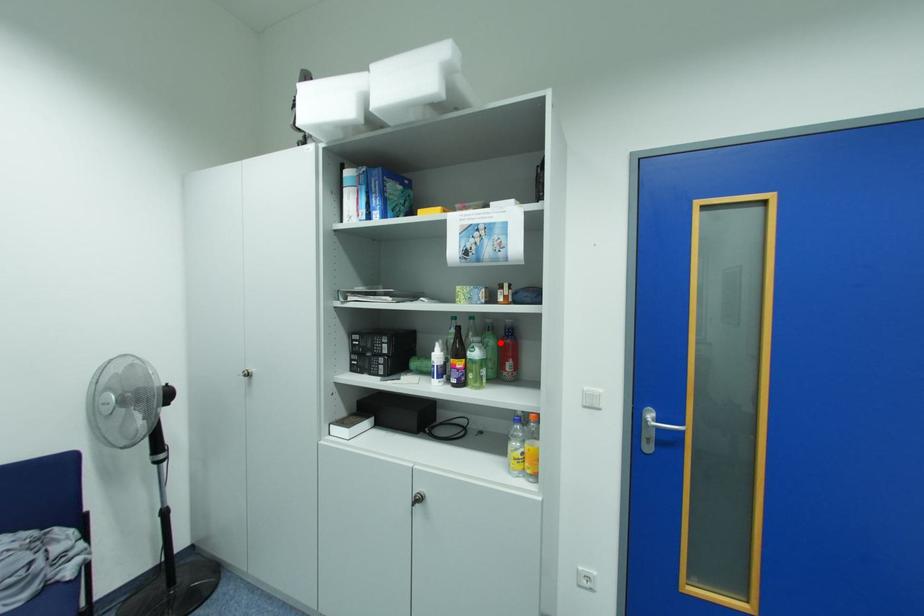
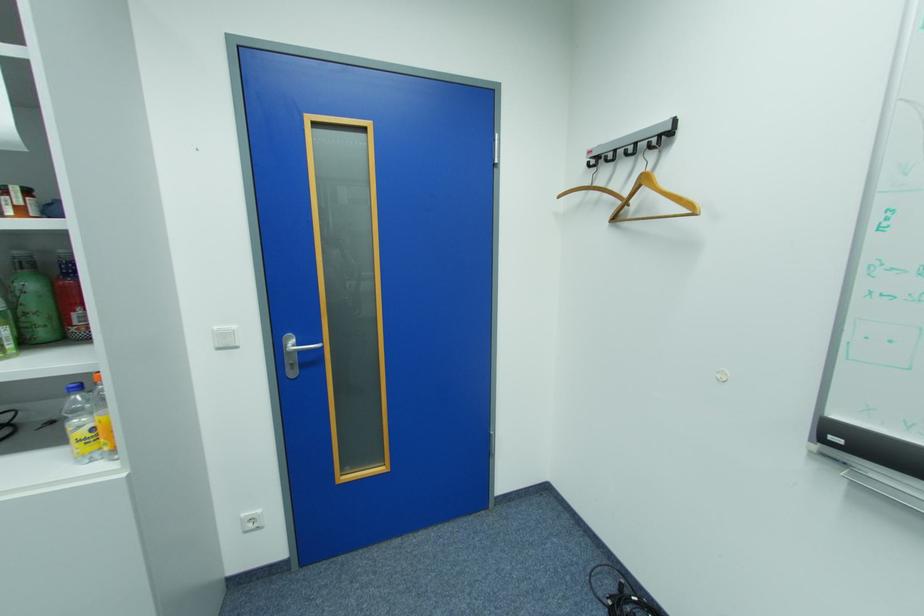
Find the pixel in the second image that matches the highlighted location in the first image.

(41, 286)